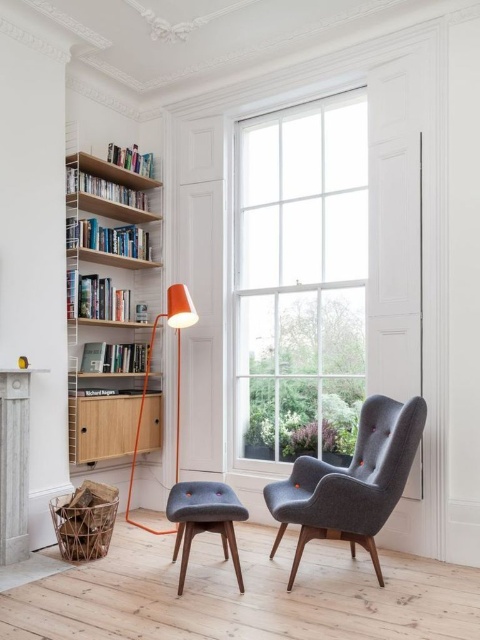
Question: Which point appears closest to the camera in this image?

Choices:
 (A) (160, 420)
 (B) (305, 492)
 (C) (134, 340)
 (D) (180, 356)

Answer: (B)

Question: Estimate the real-world distances between objects in this image. Which object is closer to the dark gray fabric armchair at right?

Choices:
 (A) white painted wood fireplace at lower left
 (B) dark gray fabric stool at center
 (C) clear glass window at center

Answer: (B)

Question: Considering the real-world distances, which object is closest to the light brown wood cabinet at left?

Choices:
 (A) wooden bookshelf at left
 (B) orange matte floor lamp at upper center
 (C) dark gray fabric armchair at right

Answer: (B)

Question: Can you confirm if wooden bookshelf at left is positioned below light brown wood cabinet at left?

Choices:
 (A) no
 (B) yes

Answer: (A)

Question: Is white painted wood fireplace at lower left below orange matte floor lamp at upper center?

Choices:
 (A) yes
 (B) no

Answer: (A)

Question: Is dark gray fabric armchair at right closer to camera compared to white painted wood fireplace at lower left?

Choices:
 (A) no
 (B) yes

Answer: (B)